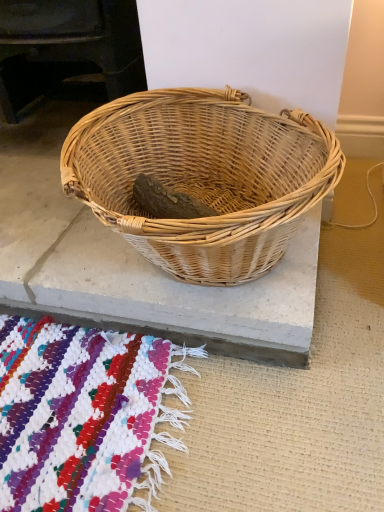
Image resolution: width=384 pixels, height=512 pixels. What do you see at coordinates (203, 177) in the screenshot? I see `natural wicker picnic basket at center` at bounding box center [203, 177].

Where is `natural wicker picnic basket at center`? This screenshot has height=512, width=384. natural wicker picnic basket at center is located at coordinates [203, 177].

What is the approximate width of natural wicker picnic basket at center?

It is 16.61 inches.

At what (x,y) coordinates should I click in order to perform the action: click on natural wicker picnic basket at center. Please return your answer as a coordinate pair (x, y). This screenshot has height=512, width=384. Looking at the image, I should click on (203, 177).